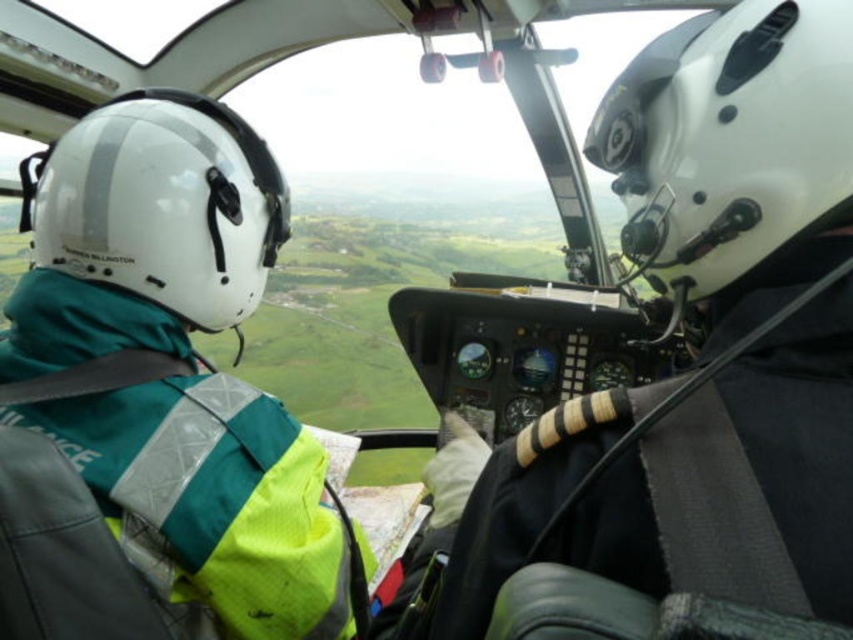
Question: Which object is closer to the camera taking this photo?

Choices:
 (A) white matte helmet at left
 (B) green fabric jacket at upper left
 (C) white matte helmet at center

Answer: (C)

Question: Is green fabric jacket at upper left thinner than white matte helmet at left?

Choices:
 (A) no
 (B) yes

Answer: (B)

Question: Can you confirm if green fabric jacket at upper left is smaller than white matte helmet at left?

Choices:
 (A) yes
 (B) no

Answer: (A)

Question: Which is nearer to the white matte helmet at left?

Choices:
 (A) green fabric jacket at upper left
 (B) white matte helmet at center

Answer: (A)

Question: Estimate the real-world distances between objects in this image. Which object is closer to the green fabric jacket at upper left?

Choices:
 (A) white matte helmet at left
 (B) white matte helmet at center

Answer: (A)

Question: Is green fabric jacket at upper left bigger than white matte helmet at center?

Choices:
 (A) yes
 (B) no

Answer: (A)